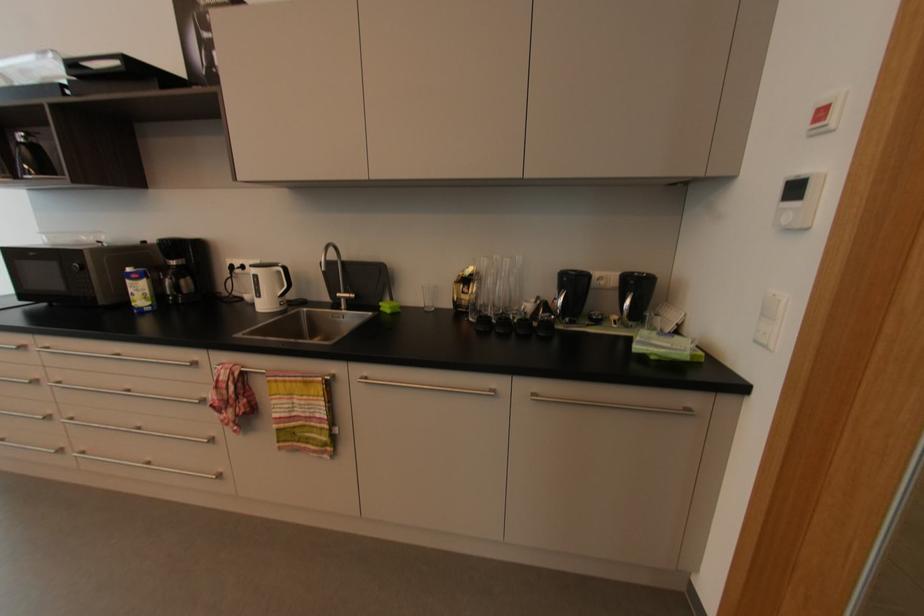
At what (x,y) coordinates should I click in order to perform the action: click on silver drawer handle. Please return your answer as a coordinate pair (x, y). The height and width of the screenshot is (616, 924). Looking at the image, I should click on (614, 406).